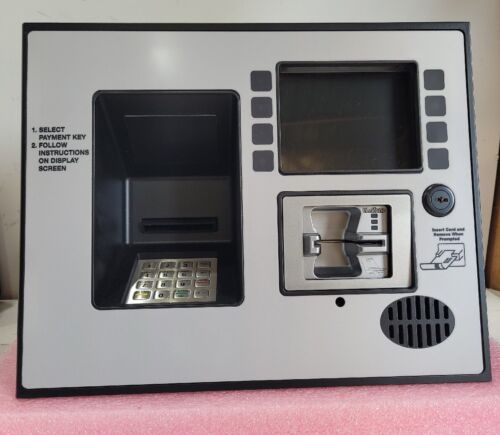
Locate an element on the screen. The image size is (500, 435). pink surface is located at coordinates (333, 413), (216, 400).